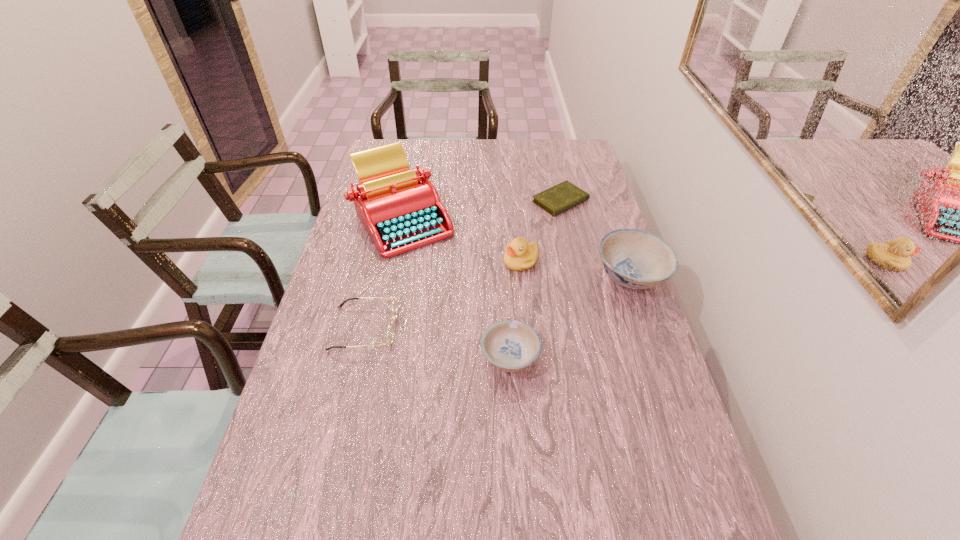
Image resolution: width=960 pixels, height=540 pixels. In order to click on vacant space at the far edge in this screenshot , I will do `click(450, 151)`.

Locate an element on the screen. This screenshot has height=540, width=960. vacant space at the left edge of the desktop is located at coordinates (336, 361).

This screenshot has height=540, width=960. Identify the location of blank space at the right edge of the desktop. (590, 183).

Image resolution: width=960 pixels, height=540 pixels. In order to click on free point at the far left corner in this screenshot , I will do `click(409, 149)`.

The width and height of the screenshot is (960, 540). In the image, there is a desktop. Find the location of `vacant region at the far right corner`. vacant region at the far right corner is located at coordinates (560, 150).

I want to click on free area in between the shortest object and the farther bowl, so click(x=596, y=238).

Identify the location of vacant space in between the left bowl and the right bowl. Image resolution: width=960 pixels, height=540 pixels. (570, 316).

The image size is (960, 540). Identify the location of vacant area that lies between the shortest object and the tallest object. (482, 210).

Find the location of a particular element. The width and height of the screenshot is (960, 540). free space that is in between the shortest object and the right bowl is located at coordinates (596, 238).

At what (x,y) coordinates should I click in order to perform the action: click on free space between the spectacles and the right bowl. Please return your answer as a coordinate pair (x, y). The width and height of the screenshot is (960, 540). Looking at the image, I should click on (497, 302).